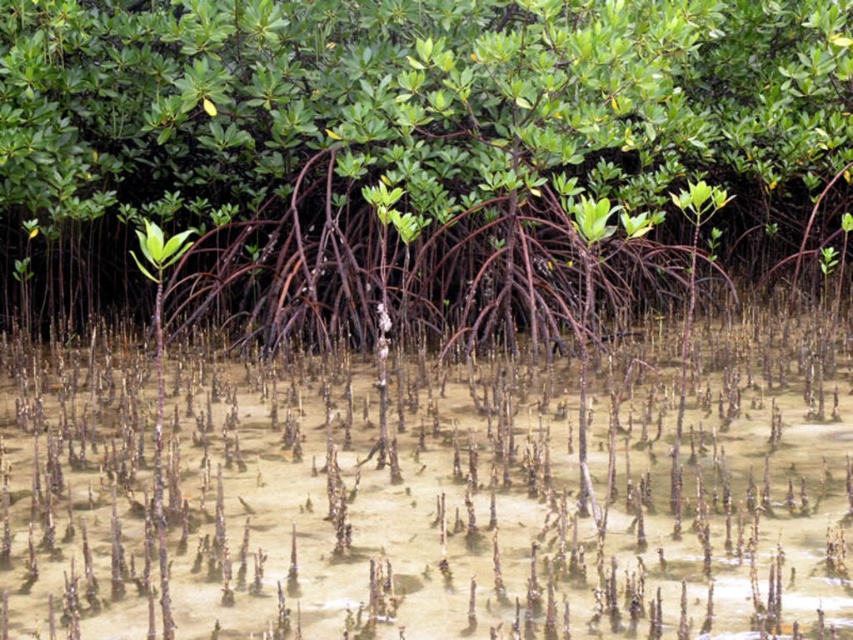
Question: Among these objects, which one is nearest to the camera?

Choices:
 (A) green matte tree roots at center
 (B) translucent sandy water at center

Answer: (B)

Question: Does green matte tree roots at center appear on the left side of translucent sandy water at center?

Choices:
 (A) yes
 (B) no

Answer: (A)

Question: Which of the following is the farthest from the observer?

Choices:
 (A) translucent sandy water at center
 (B) green matte tree roots at center

Answer: (B)

Question: Does green matte tree roots at center have a lesser width compared to translucent sandy water at center?

Choices:
 (A) no
 (B) yes

Answer: (A)

Question: Can you confirm if green matte tree roots at center is positioned to the left of translucent sandy water at center?

Choices:
 (A) yes
 (B) no

Answer: (A)